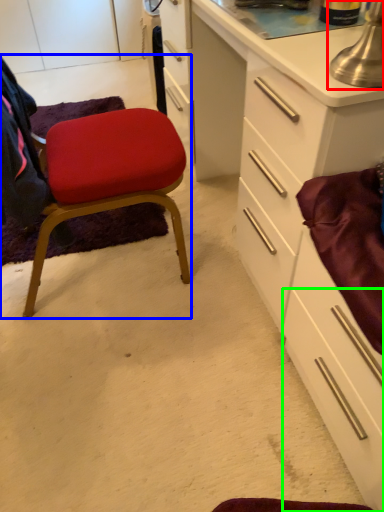
Question: Estimate the real-world distances between objects in this image. Which object is farther from table lamp (highlighted by a red box), chair (highlighted by a blue box) or drawer (highlighted by a green box)?

Choices:
 (A) chair
 (B) drawer

Answer: (A)